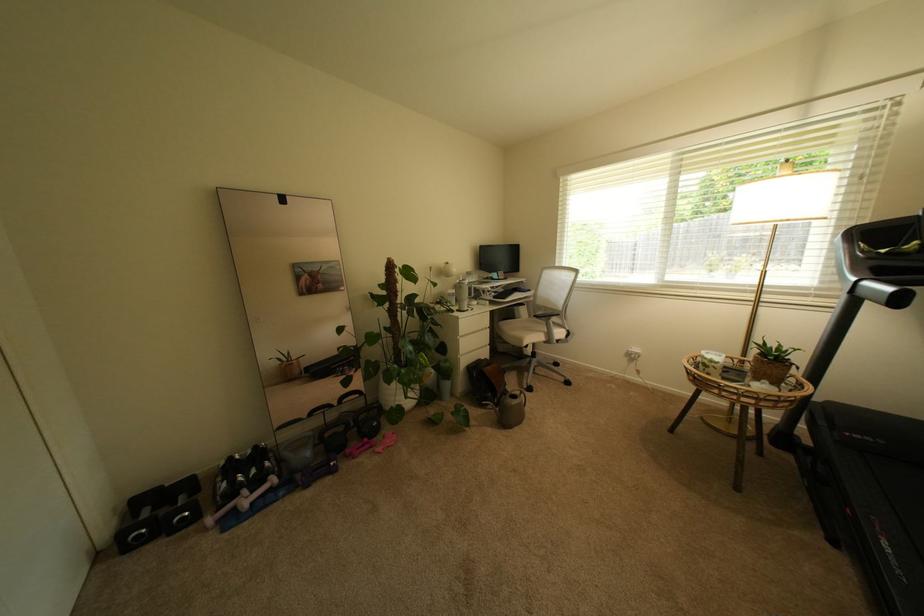
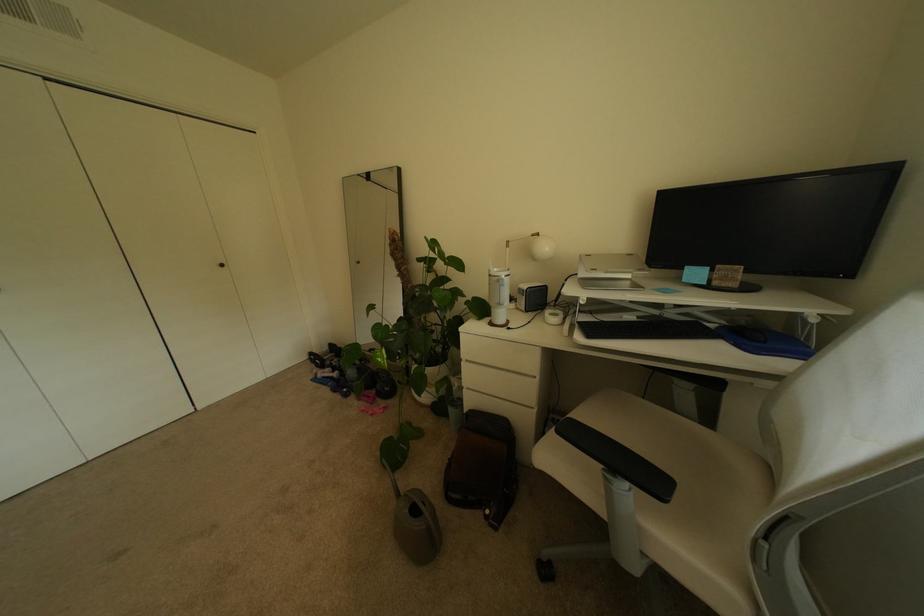
Where in the second image is the point corresponding to point 280,490 from the first image?

(341, 379)